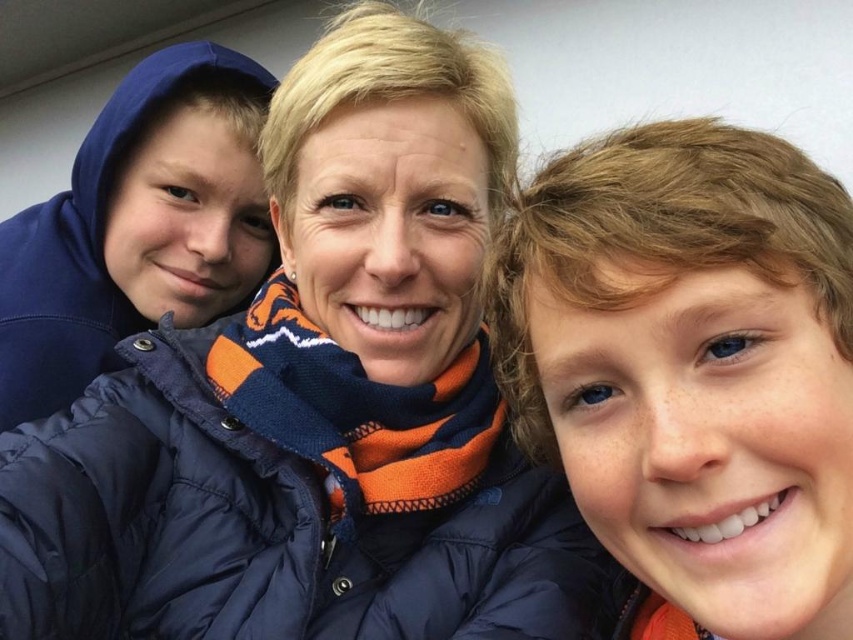
Question: Which object is closer to the camera taking this photo?

Choices:
 (A) blue fleece hoodie at left
 (B) brown curly hair at upper right

Answer: (B)

Question: Is navy blue puffer jacket at center closer to the viewer compared to blue fleece hoodie at left?

Choices:
 (A) no
 (B) yes

Answer: (B)

Question: Which object is farther from the camera taking this photo?

Choices:
 (A) navy blue puffer jacket at center
 (B) blue fleece hoodie at left
 (C) brown curly hair at upper right

Answer: (B)

Question: Is navy blue puffer jacket at center bigger than brown curly hair at upper right?

Choices:
 (A) no
 (B) yes

Answer: (B)

Question: Which is farther from the brown curly hair at upper right?

Choices:
 (A) navy blue puffer jacket at center
 (B) blue fleece hoodie at left

Answer: (B)

Question: In this image, where is navy blue puffer jacket at center located relative to brown curly hair at upper right?

Choices:
 (A) above
 (B) below

Answer: (A)